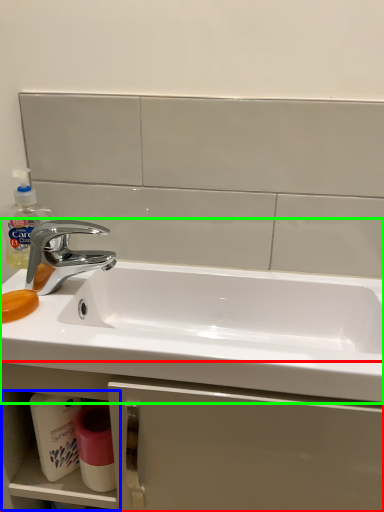
Question: Which object is the farthest from bathroom cabinet (highlighted by a red box)? Choose among these: shelf (highlighted by a blue box) or sink (highlighted by a green box).

Choices:
 (A) shelf
 (B) sink

Answer: (B)